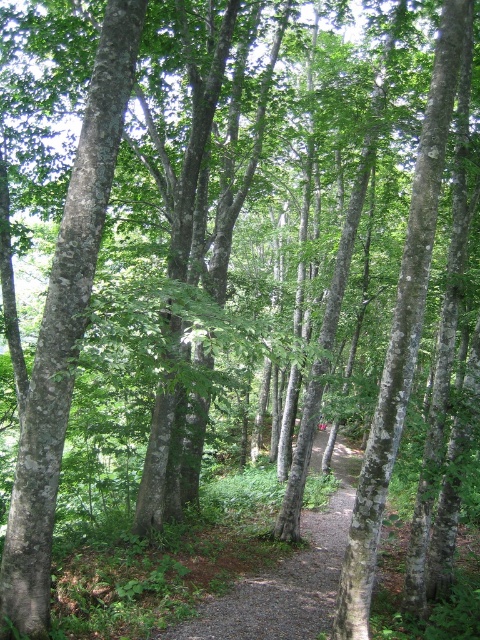
You are standing at the start of the forest path and want to reach a specific point marked as point (78, 314). If your walking speed is 1.5 meters per second, how many seconds will it take you to reach that point?

The distance of point (78, 314) from viewer is 6.09 meters. At a walking speed of 1.5 meters per second, it will take 6.09 divided by 1.5, which is approximately 4.06 seconds to reach the point.